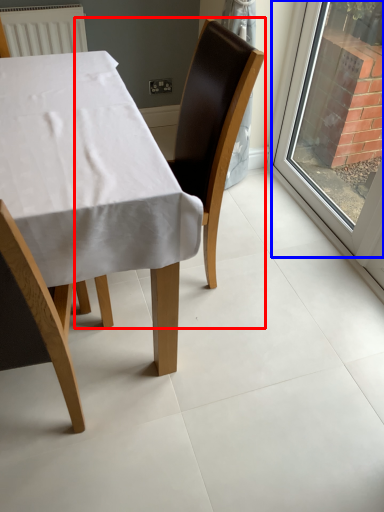
Question: Which object appears closest to the camera in this image, chair (highlighted by a red box) or window (highlighted by a blue box)?

Choices:
 (A) chair
 (B) window

Answer: (A)